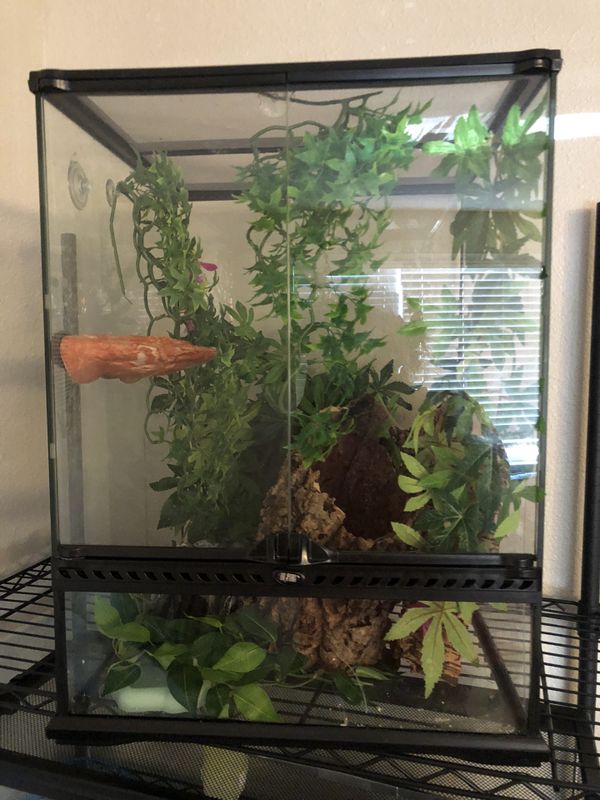
You are a GUI agent. You are given a task and a screenshot of the screen. Output one action in this format:
    pyautogui.click(x=<x>, y=<y>)
    Task: Click on the part of wire stand
    
    Given the screenshot: What is the action you would take?
    pyautogui.click(x=586, y=685), pyautogui.click(x=593, y=560), pyautogui.click(x=594, y=424)